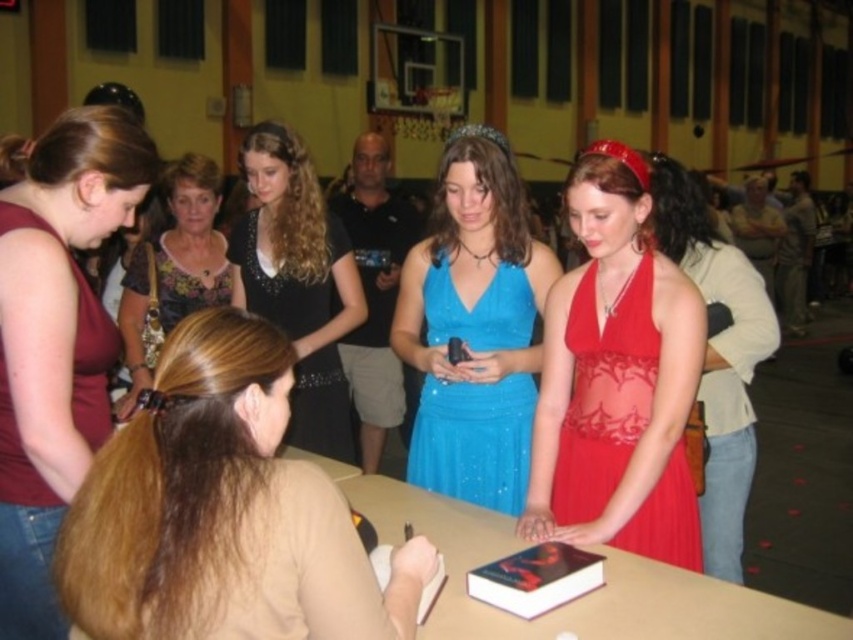
Question: Is brown hair at center behind floral fabric blouse at center?

Choices:
 (A) yes
 (B) no

Answer: (B)

Question: Does sparkly blue dress at center have a greater width compared to matte red dress at center?

Choices:
 (A) yes
 (B) no

Answer: (B)

Question: Considering the real-world distances, which object is farthest from the smooth wooden table at center?

Choices:
 (A) black satin dress at center
 (B) matte red shirt at left

Answer: (B)

Question: Which of the following is the farthest from the observer?

Choices:
 (A) (608, 561)
 (B) (340, 404)
 (C) (503, 308)

Answer: (B)

Question: Which point is closer to the camera taking this photo?

Choices:
 (A) tap(149, 320)
 (B) tap(233, 493)

Answer: (B)

Question: Can you confirm if black satin dress at center is thinner than satin red dress at center?

Choices:
 (A) no
 (B) yes

Answer: (A)